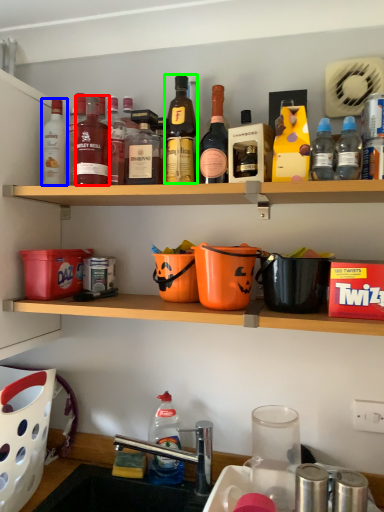
Question: Which object is positioned farthest from bottle (highlighted by a red box)? Select from bottle (highlighted by a blue box) and bottle (highlighted by a green box).

Choices:
 (A) bottle
 (B) bottle

Answer: (B)